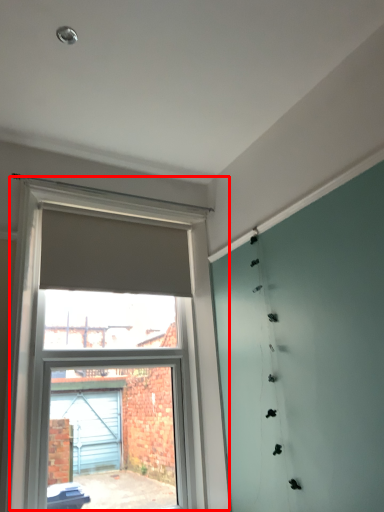
Question: Where is window (annotated by the red box) located in relation to curtain in the image?

Choices:
 (A) right
 (B) left

Answer: (A)